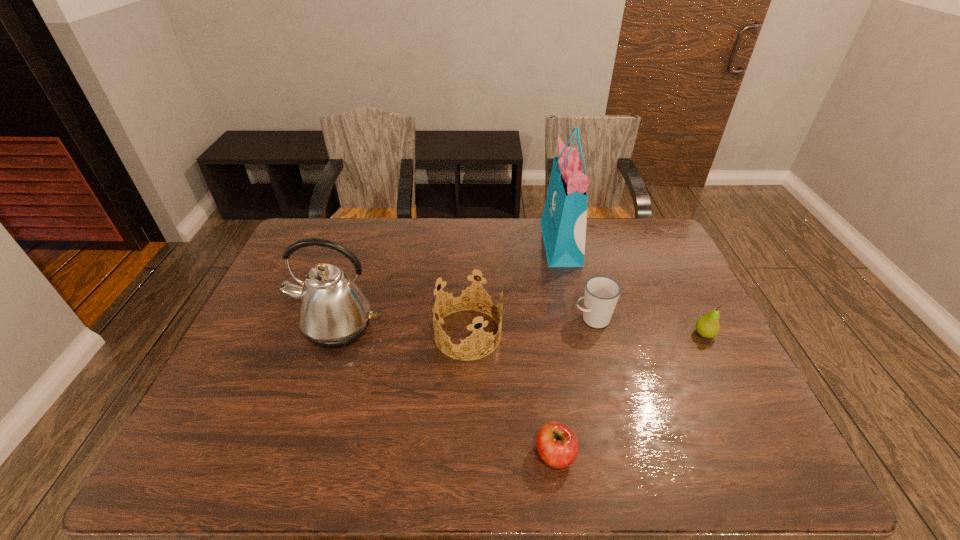
Where is `free space between the pear and the cup`? free space between the pear and the cup is located at coordinates (648, 327).

Where is `vacant area that lies between the cup and the farthest object`? vacant area that lies between the cup and the farthest object is located at coordinates (577, 281).

At what (x,y) coordinates should I click in order to perform the action: click on vacant area between the fifth object from right to left and the fifth shortest object. Please return your answer as a coordinate pair (x, y). The image size is (960, 540). Looking at the image, I should click on (402, 330).

At what (x,y) coordinates should I click in order to perform the action: click on vacant space in between the tallest object and the cup. Please return your answer as a coordinate pair (x, y). This screenshot has width=960, height=540. Looking at the image, I should click on (577, 281).

I want to click on vacant point located between the second object from left to right and the kettle, so click(402, 330).

Identify the location of blank region between the rightmost object and the apple. (630, 394).

Find the location of `object that is the closest to the second object from left to right`. object that is the closest to the second object from left to right is located at coordinates (333, 312).

Find the location of `object that stands as the closest to the pear`. object that stands as the closest to the pear is located at coordinates (601, 294).

Identify the location of blank space that satisfies the following two spatial constraints: 1. with a handle on the side of the rightmost object; 2. on the right side of the cup. The width and height of the screenshot is (960, 540). (596, 334).

Identify the location of vacant position in the image that satisfies the following two spatial constraints: 1. with a handle on the side of the cup; 2. from the spout of the second tallest object. This screenshot has width=960, height=540. (595, 327).